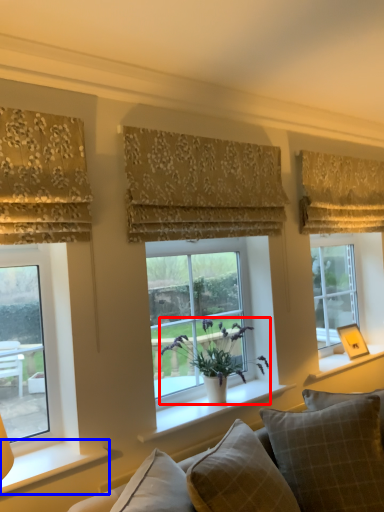
Question: Which of the following is the closest to the observer, houseplant (highlighted by a red box) or window sill (highlighted by a blue box)?

Choices:
 (A) houseplant
 (B) window sill

Answer: (B)